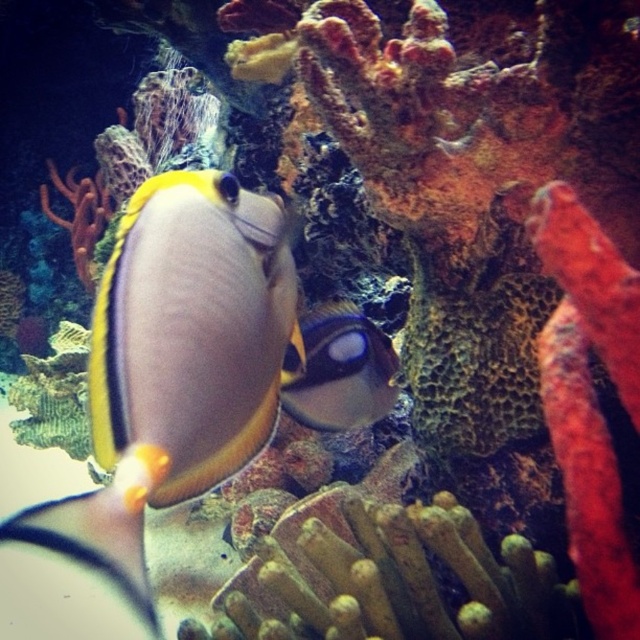
You are an underwater photographer aiming to capture both the shiny yellow and black fish at center and the shiny blue and yellow fish at center in a single frame. Given that your camera can only focus on objects within a 10 cm height range, will you be able to include both fish in your shot?

The shiny yellow and black fish at center has a greater height compared to the shiny blue and yellow fish at center. Since the height difference between them is not specified, but the camera requires both to be within a 10 cm height range, it depends on their actual height difference. However, based on the information provided, we cannot determine if their height difference exceeds 10 cm. Therefore, it is uncertain whether both can be captured in one frame.

You are a marine biologist observing the two fish in the image. Which fish is smaller in width between the shiny yellow and black fish at center and the shiny blue and yellow fish at center?

The shiny yellow and black fish at center has a lesser width compared to the shiny blue and yellow fish at center, so the shiny yellow and black fish at center is smaller in width.